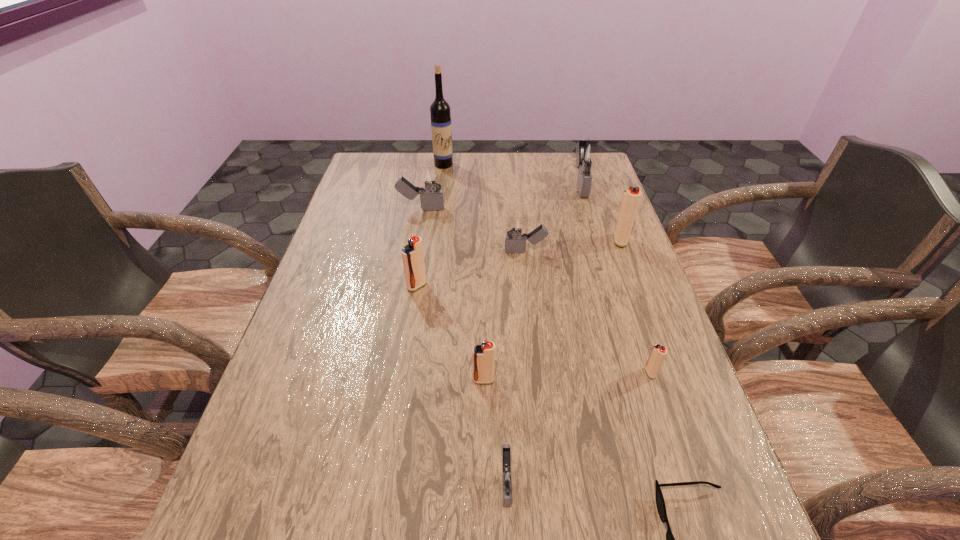
Identify the location of free space located on the front of the third biggest gray igniter. The image size is (960, 540). (540, 368).

Identify the location of blank area located on the right of the third red igniter from right to left. (575, 380).

The image size is (960, 540). I want to click on free location located 0.160m on the back of the third red igniter from left to right, so click(630, 312).

This screenshot has width=960, height=540. What are the coordinates of `vacant space located 0.360m on the back of the nearest gray igniter` in the screenshot? It's located at (499, 312).

This screenshot has width=960, height=540. Find the location of `wine bottle present at the far edge`. wine bottle present at the far edge is located at coordinates (441, 128).

Identify the location of igniter present at the far edge. (588, 154).

This screenshot has width=960, height=540. Find the location of `object present at the far right corner`. object present at the far right corner is located at coordinates (588, 154).

Locate an element on the screen. free point at the far edge is located at coordinates (474, 165).

Locate an element on the screen. blank space at the left edge of the desktop is located at coordinates (348, 271).

Image resolution: width=960 pixels, height=540 pixels. In order to click on free space at the right edge in this screenshot , I will do [x=647, y=409].